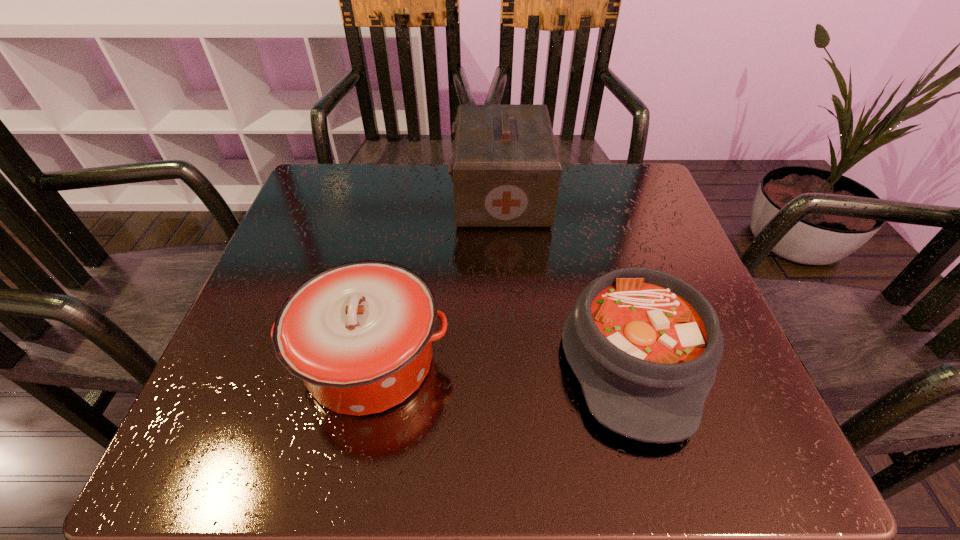
Select which object appears as the closest to the left casserole. Please provide its 2D coordinates. Your answer should be formatted as a tuple, i.e. [(x, y)], where the tuple contains the x and y coordinates of a point satisfying the conditions above.

[(645, 345)]

Identify which object is located as the nearest to the second tallest object. Please provide its 2D coordinates. Your answer should be formatted as a tuple, i.e. [(x, y)], where the tuple contains the x and y coordinates of a point satisfying the conditions above.

[(645, 345)]

Locate an element on the screen. vacant space that satisfies the following two spatial constraints: 1. on the front side of the farthest object; 2. on the right side of the right casserole is located at coordinates (511, 354).

Find the location of a particular element. Image resolution: width=960 pixels, height=540 pixels. vacant space that satisfies the following two spatial constraints: 1. on the back side of the second shortest object; 2. on the right side of the farthest object is located at coordinates (404, 194).

At what (x,y) coordinates should I click in order to perform the action: click on free space in the image that satisfies the following two spatial constraints: 1. on the front side of the first-aid kit; 2. on the right side of the shorter casserole. Please return your answer as a coordinate pair (x, y). Looking at the image, I should click on (511, 354).

Locate an element on the screen. The width and height of the screenshot is (960, 540). vacant point that satisfies the following two spatial constraints: 1. on the back side of the left casserole; 2. on the left side of the farthest object is located at coordinates 404,194.